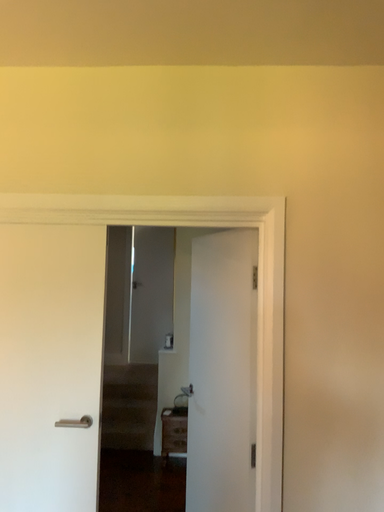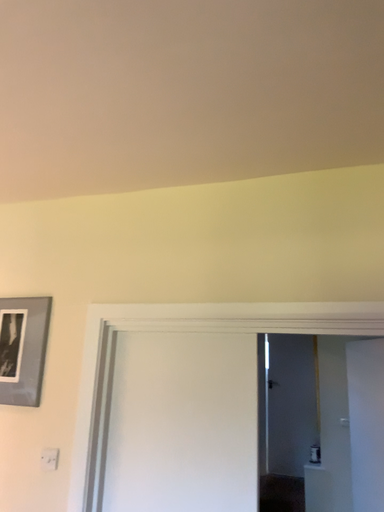
Question: Which way did the camera rotate in the video?

Choices:
 (A) rotated downward
 (B) rotated upward

Answer: (B)